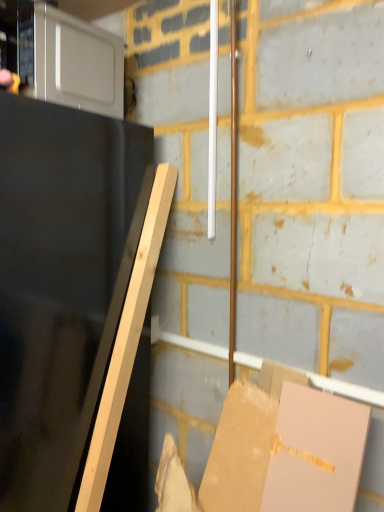
Question: Should I look upward or downward to see matte black tv at left?

Choices:
 (A) down
 (B) up

Answer: (A)